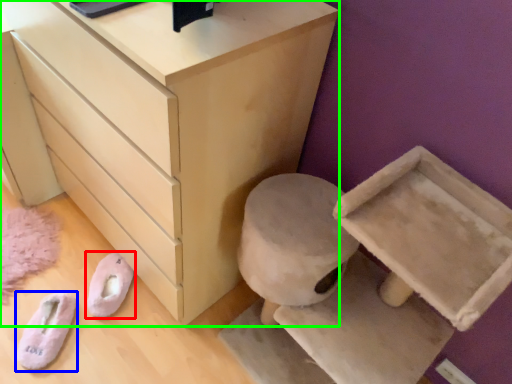
Question: Which object is positioned closest to footwear (highlighted by a red box)? Select from footwear (highlighted by a blue box) and chest of drawers (highlighted by a green box).

Choices:
 (A) footwear
 (B) chest of drawers

Answer: (A)